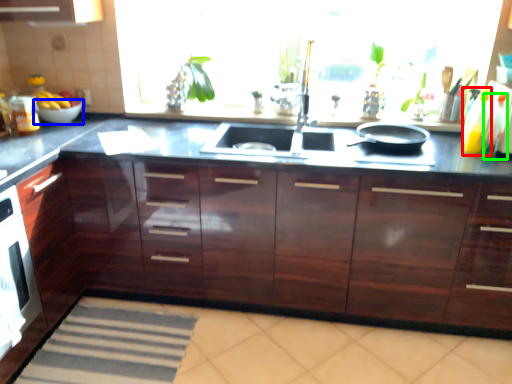
Question: Which is nearer to the bottle (highlighted by a red box)? bowl (highlighted by a blue box) or bottle (highlighted by a green box).

Choices:
 (A) bowl
 (B) bottle

Answer: (B)